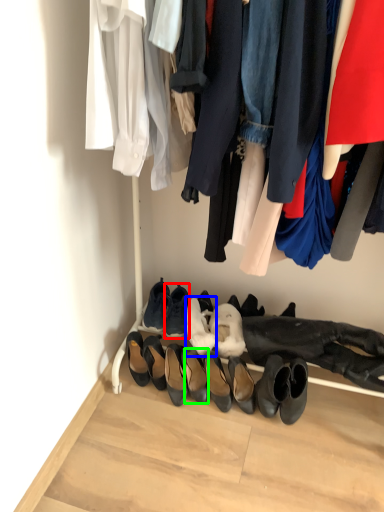
Question: Based on their relative distances, which object is farther from footwear (highlighted by a red box)? Choose from shoe (highlighted by a blue box) and footwear (highlighted by a green box).

Choices:
 (A) shoe
 (B) footwear

Answer: (B)